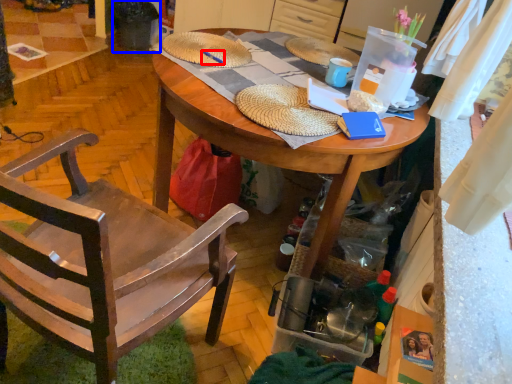
Question: Which object appears farthest to the camera in this image, pen (highlighted by a red box) or trash bin/can (highlighted by a blue box)?

Choices:
 (A) pen
 (B) trash bin/can

Answer: (B)